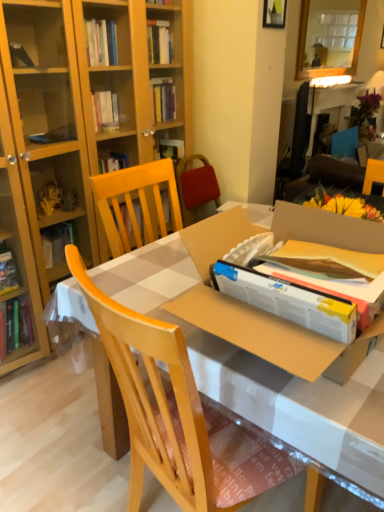
Question: Is glossy wooden mirror at upper center in contact with wooden picture frame at upper center?

Choices:
 (A) yes
 (B) no

Answer: (B)

Question: Does glossy wooden mirror at upper center appear on the left side of wooden picture frame at upper center?

Choices:
 (A) yes
 (B) no

Answer: (B)

Question: From a real-world perspective, is glossy wooden mirror at upper center located beneath wooden picture frame at upper center?

Choices:
 (A) no
 (B) yes

Answer: (B)

Question: Considering the relative positions of glossy wooden mirror at upper center and wooden picture frame at upper center in the image provided, is glossy wooden mirror at upper center in front of wooden picture frame at upper center?

Choices:
 (A) no
 (B) yes

Answer: (A)

Question: Is glossy wooden mirror at upper center far from wooden picture frame at upper center?

Choices:
 (A) yes
 (B) no

Answer: (A)

Question: Is light wood chair at center in front of or behind glossy wooden mirror at upper center in the image?

Choices:
 (A) behind
 (B) front

Answer: (B)

Question: From a real-world perspective, is light wood chair at center positioned above or below glossy wooden mirror at upper center?

Choices:
 (A) above
 (B) below

Answer: (B)

Question: From the image's perspective, is light wood chair at center positioned above or below glossy wooden mirror at upper center?

Choices:
 (A) above
 (B) below

Answer: (B)

Question: In terms of size, does light wood chair at center appear bigger or smaller than glossy wooden mirror at upper center?

Choices:
 (A) small
 (B) big

Answer: (B)

Question: Considering the positions of point (326, 7) and point (268, 13), is point (326, 7) closer or farther from the camera than point (268, 13)?

Choices:
 (A) closer
 (B) farther

Answer: (B)

Question: In terms of height, does glossy wooden mirror at upper center look taller or shorter compared to wooden picture frame at upper center?

Choices:
 (A) tall
 (B) short

Answer: (A)

Question: Is glossy wooden mirror at upper center inside or outside of wooden picture frame at upper center?

Choices:
 (A) inside
 (B) outside

Answer: (B)

Question: In terms of size, does glossy wooden mirror at upper center appear bigger or smaller than wooden picture frame at upper center?

Choices:
 (A) small
 (B) big

Answer: (B)

Question: Is cardboard box at center in front of or behind glossy wooden mirror at upper center in the image?

Choices:
 (A) front
 (B) behind

Answer: (A)

Question: Which is correct: cardboard box at center is inside glossy wooden mirror at upper center, or outside of it?

Choices:
 (A) inside
 (B) outside

Answer: (B)